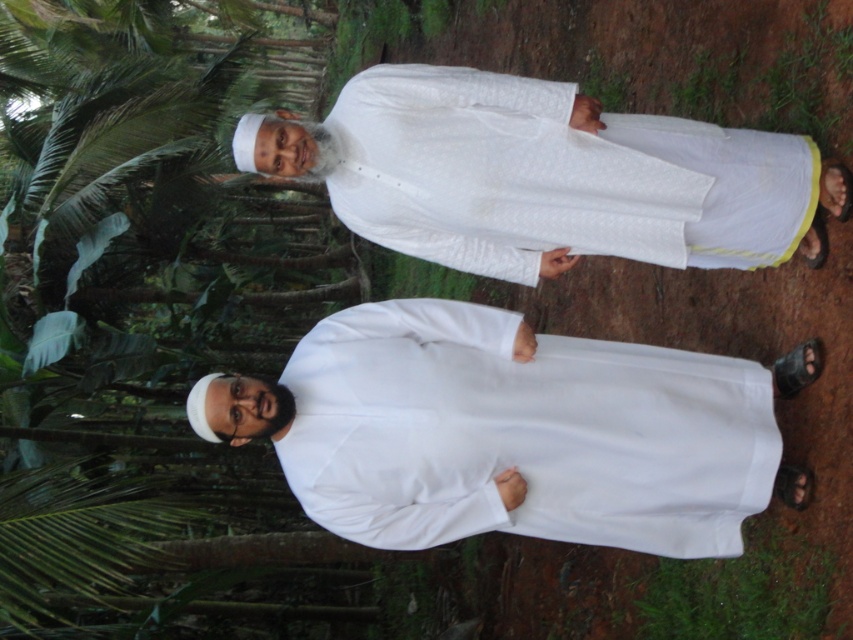
Question: Which object is farther from the camera taking this photo?

Choices:
 (A) white matte/soft fabric at center
 (B) white textured robe at center

Answer: (A)

Question: Which point appears closest to the camera in this image?

Choices:
 (A) (602, 214)
 (B) (705, 419)

Answer: (A)

Question: Does white matte/soft fabric at center come behind white textured robe at center?

Choices:
 (A) no
 (B) yes

Answer: (B)

Question: Which of the following is the closest to the observer?

Choices:
 (A) (338, 150)
 (B) (457, 534)

Answer: (A)

Question: Where is white matte/soft fabric at center located in relation to white textured robe at center in the image?

Choices:
 (A) left
 (B) right

Answer: (A)

Question: Does white matte/soft fabric at center lie behind white textured robe at center?

Choices:
 (A) yes
 (B) no

Answer: (A)